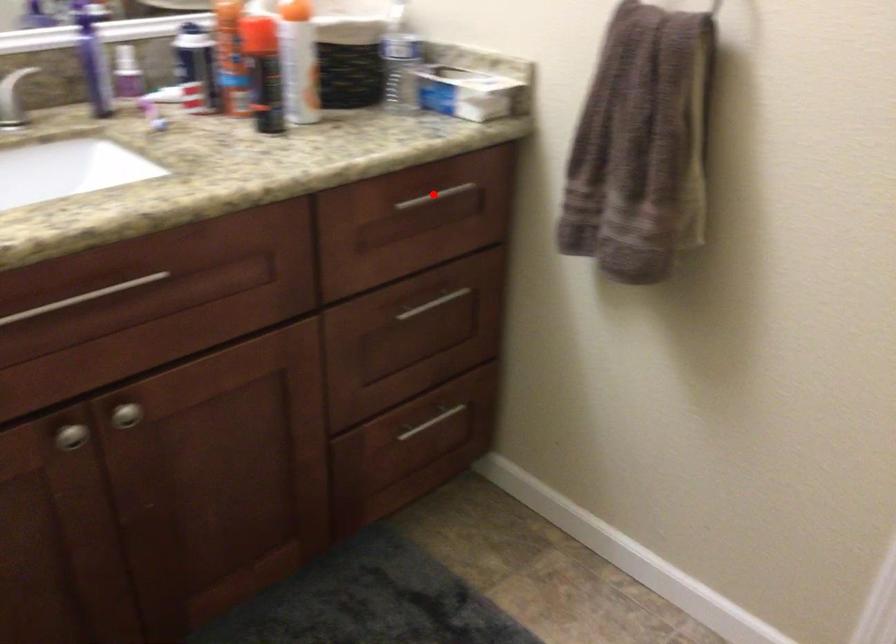
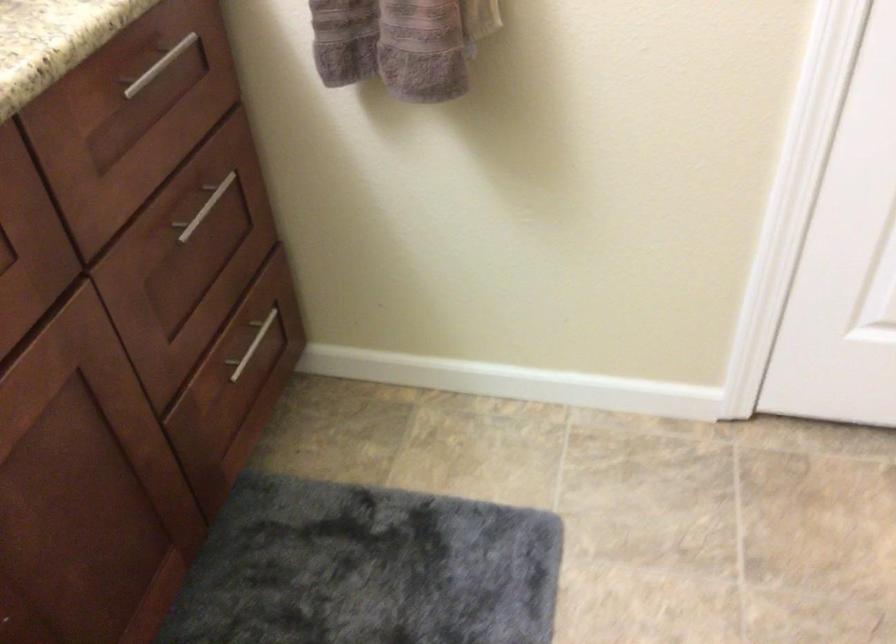
The point at the highlighted location is marked in the first image. Where is the corresponding point in the second image?

(159, 66)